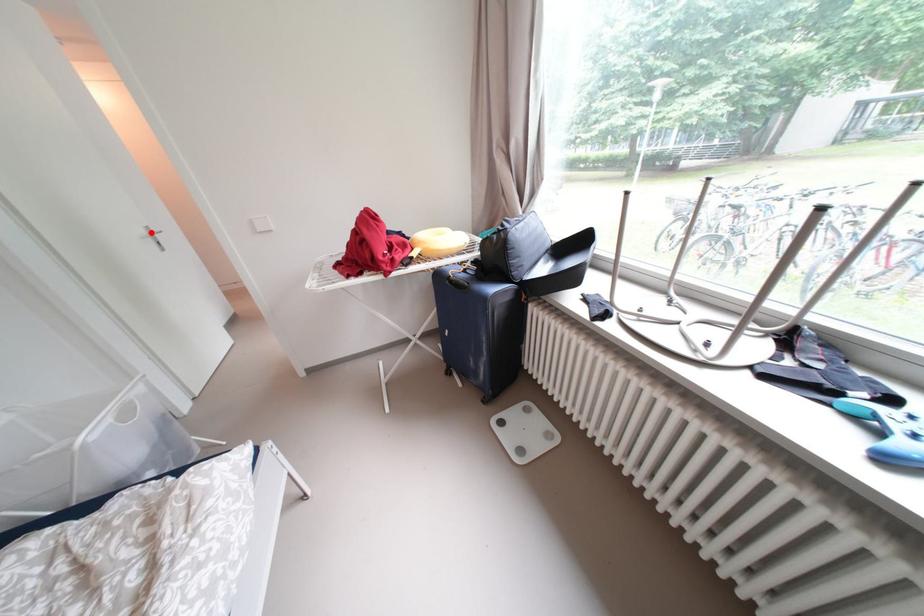
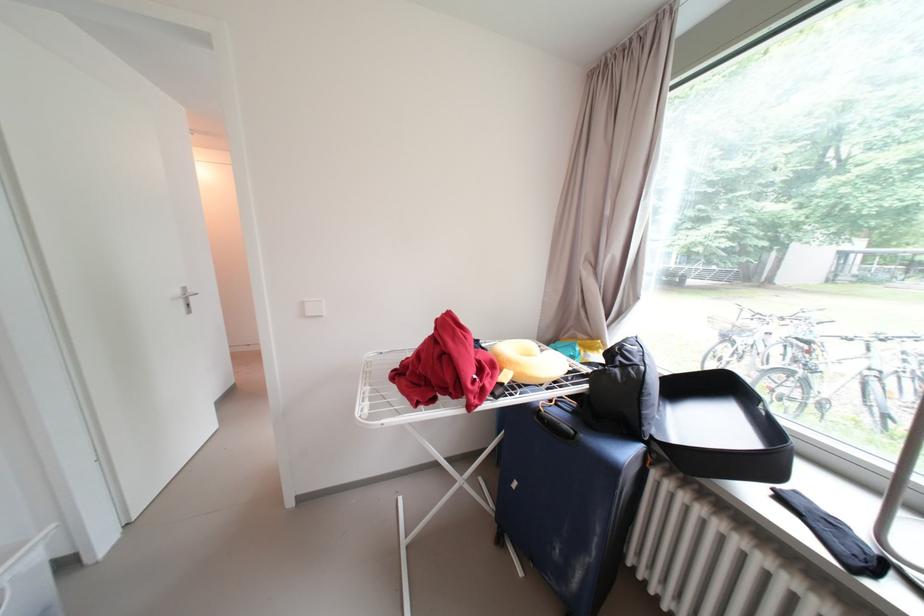
The point at the highlighted location is marked in the first image. Where is the corresponding point in the second image?

(187, 293)